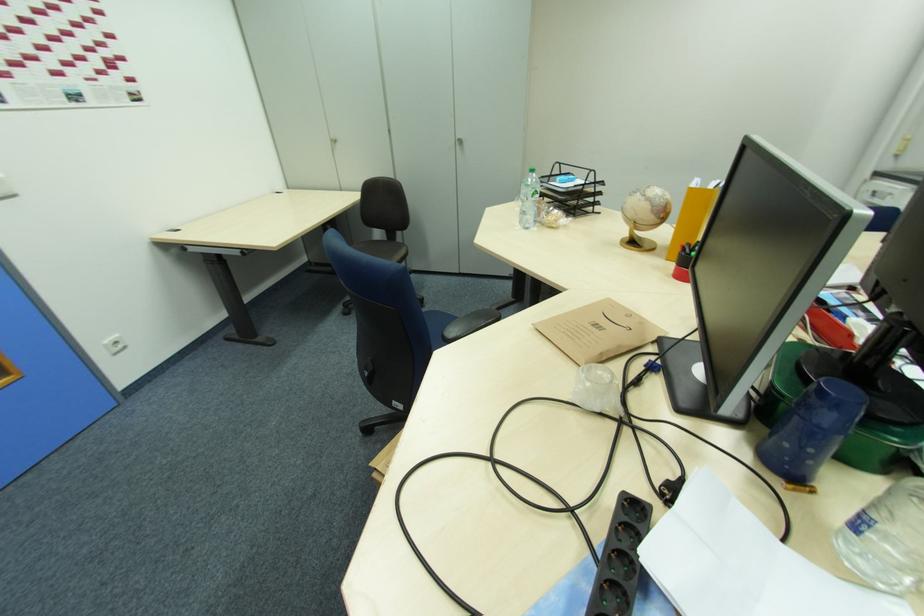
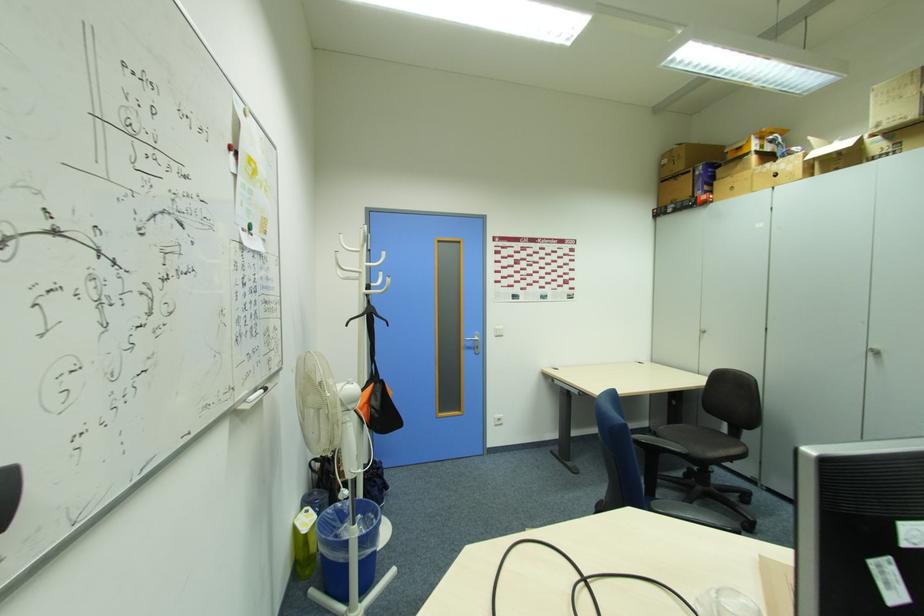
In the second image, find the point that corresponds to [465,142] in the first image.

(880, 354)